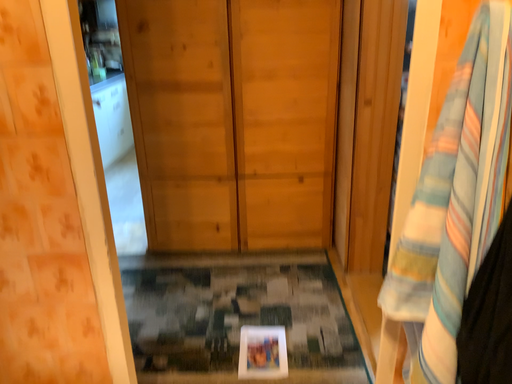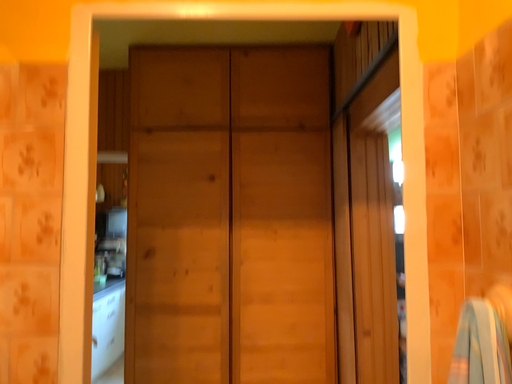
Question: How did the camera likely rotate when shooting the video?

Choices:
 (A) rotated downward
 (B) rotated upward

Answer: (B)